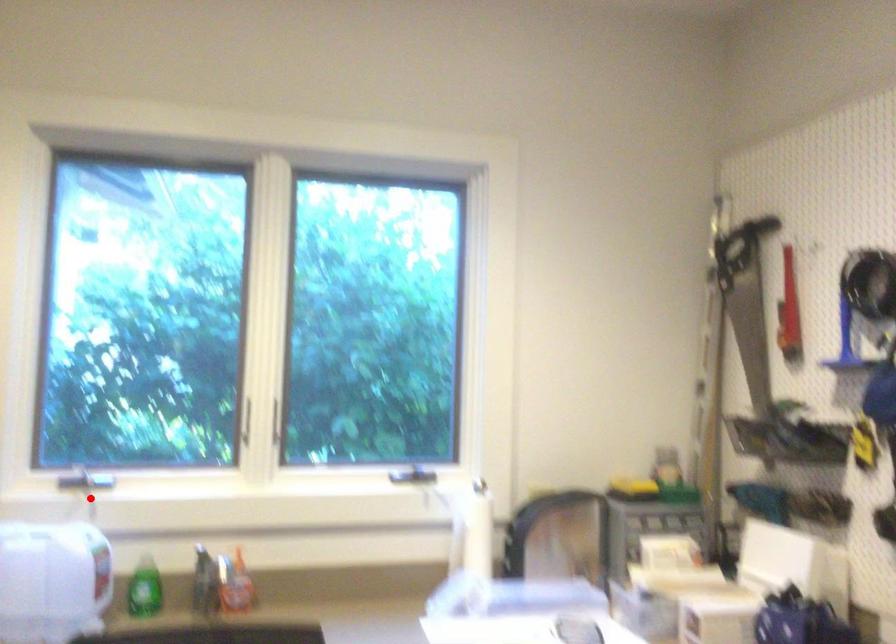
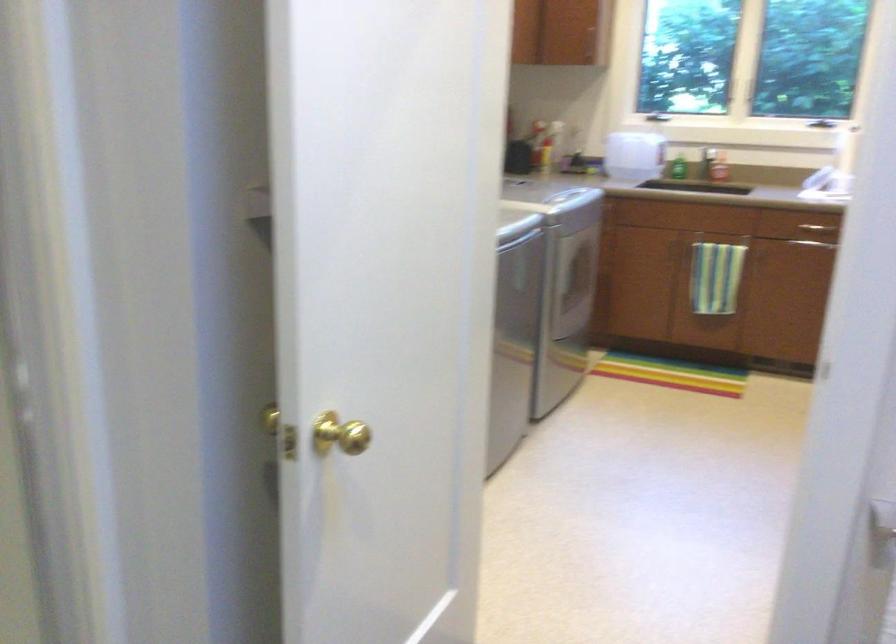
Question: I am providing you with two images of the same scene from different viewpoints. In image1, a red point is highlighted. Considering the same 3D point in image2, which of the following is correct?

Choices:
 (A) It is closer
 (B) It is farther

Answer: (B)